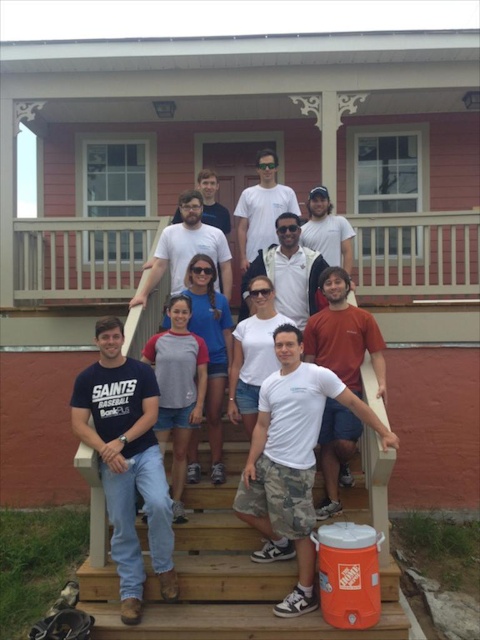
Looking at this image, you are a photographer setting up for a group photo. You notice the white wooden railing at upper center and the white matte sunglasses at center. Which object should you adjust to ensure both fit within the frame without overlapping? Explain your reasoning.

The white wooden railing at upper center has a smaller size compared to the white matte sunglasses at center. Since the sunglasses are larger, you should adjust their position to prevent them from overlapping with the railing.